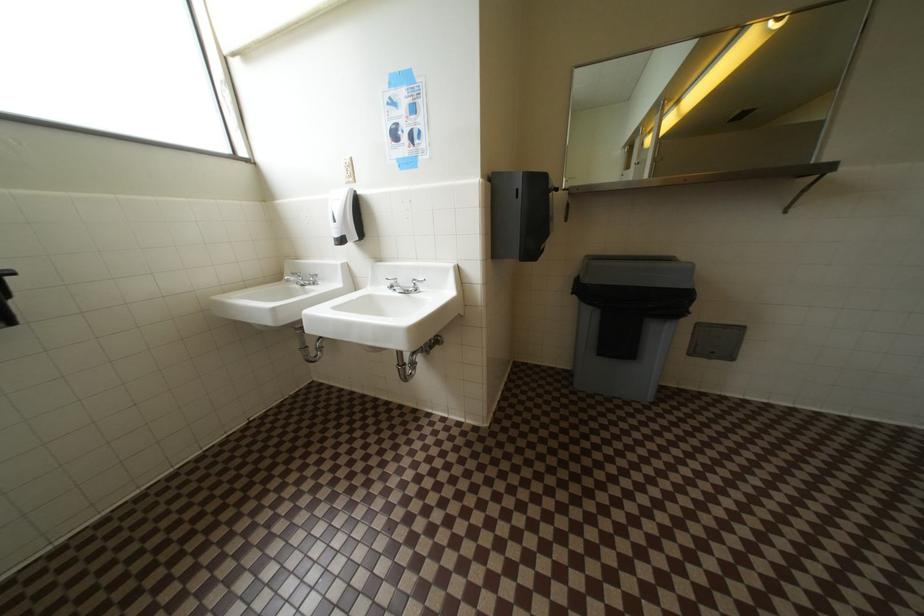
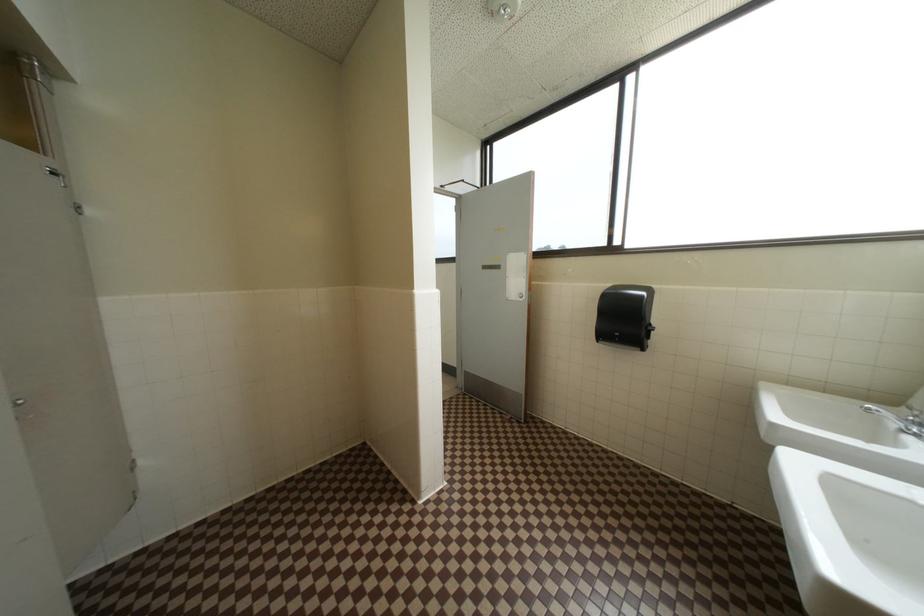
The first image is from the beginning of the video and the second image is from the end. How did the camera likely rotate when shooting the video?

The camera's rotation is toward left-down.